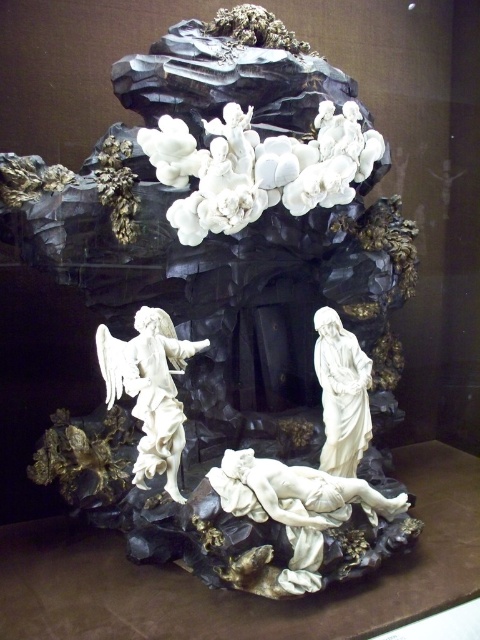
Can you confirm if white porcelain angel at left is positioned to the right of white marble angel at center?

No, white porcelain angel at left is not to the right of white marble angel at center.

Is white porcelain angel at left smaller than white marble angel at center?

No, white porcelain angel at left is not smaller than white marble angel at center.

Which is behind, point (170, 324) or point (337, 380)?

Point (337, 380)

In order to click on white porcelain angel at left in this screenshot , I will do `click(149, 388)`.

Is white porcelain cloud at upper center positioned behind white porcelain angel at center?

Yes, white porcelain cloud at upper center is further from the viewer.

Between point (350, 180) and point (256, 515), which one is positioned behind?

The point (350, 180) is more distant.

You are a GUI agent. You are given a task and a screenshot of the screen. Output one action in this format:
    pyautogui.click(x=<x>, y=<y>)
    Task: Click on the white porcelain cloud at upper center
    
    Given the screenshot: What is the action you would take?
    pyautogui.click(x=257, y=168)

Where is `white porcelain cloud at upper center`? white porcelain cloud at upper center is located at coordinates (257, 168).

Which is more to the right, white porcelain cloud at upper center or white marble angel at center?

white marble angel at center is more to the right.

Where is `white porcelain cloud at upper center`? white porcelain cloud at upper center is located at coordinates (257, 168).